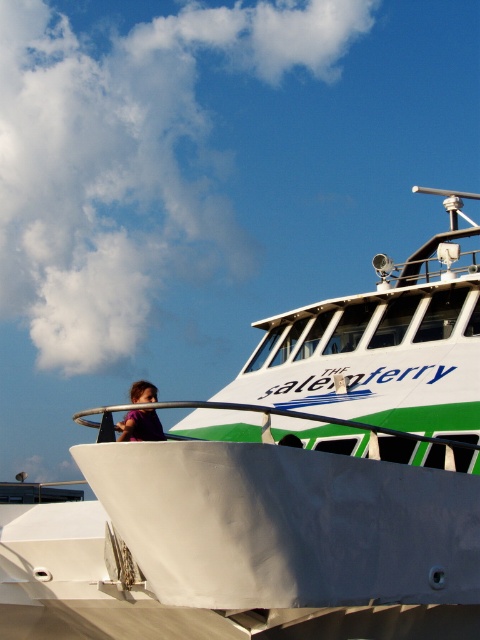
Looking at this image, you are an observer on the ferry. You see the white matte ferry at center and the purple fabric at upper left. Which object is closer to you?

The white matte ferry at center is closer to you because it is positioned over the purple fabric at upper left.

You are an observer on the ferry and want to take a photo of the purple fabric at upper left. Since the white matte ferry at center is blocking your view, can you move to a higher position to see it?

The white matte ferry at center is much taller than the purple fabric at upper left, so moving to a higher position might not help because the ferry will still block the view.